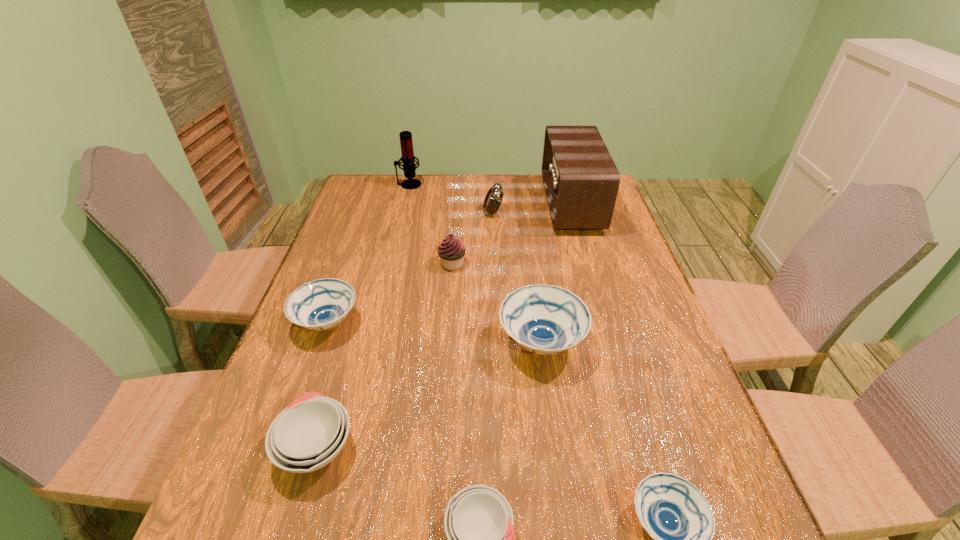
Choose which soup bowl is the fourth nearest neighbor to the bigger white soup bowl. Please provide its 2D coordinates. Your answer should be formatted as a tuple, i.e. [(x, y)], where the tuple contains the x and y coordinates of a point satisfying the conditions above.

[(678, 517)]

The width and height of the screenshot is (960, 540). Find the location of `soup bowl that can be found as the closest to the red microphone`. soup bowl that can be found as the closest to the red microphone is located at coordinates (322, 304).

This screenshot has height=540, width=960. I want to click on blue soup bowl identified as the second closest to the fifth tallest object, so click(322, 304).

Identify the location of the second closest blue soup bowl to the microphone. (544, 319).

The height and width of the screenshot is (540, 960). What are the coordinates of `free spot that satisfies the following two spatial constraints: 1. on the front side of the microphone; 2. on the left side of the pink cupcake` in the screenshot? It's located at (390, 264).